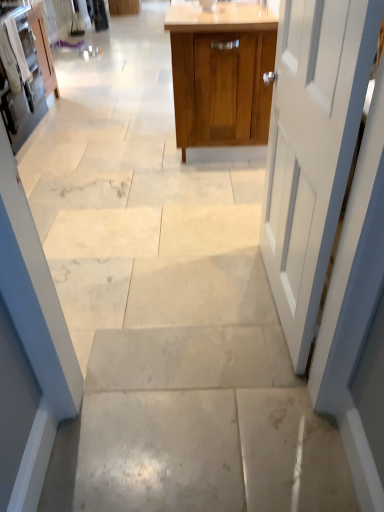
Where is `free space to the back side of white painted wood door at right`? Image resolution: width=384 pixels, height=512 pixels. free space to the back side of white painted wood door at right is located at coordinates (220, 241).